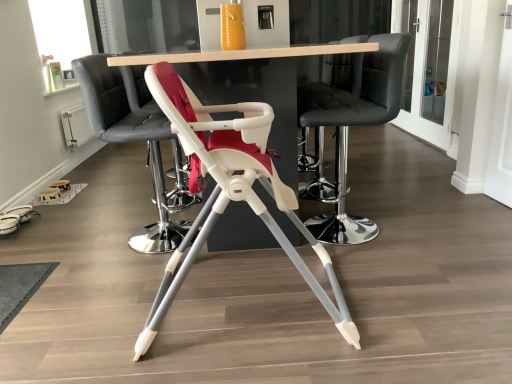
Identify the location of free space in front of white plastic highchair at center, marked as the 3th chair in a front-to-back arrangement. This screenshot has width=512, height=384. (121, 278).